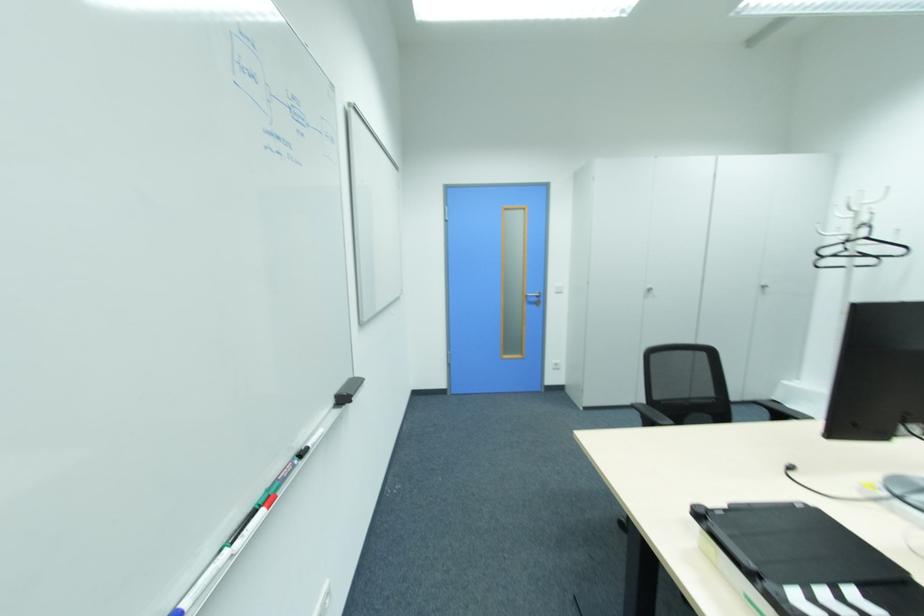
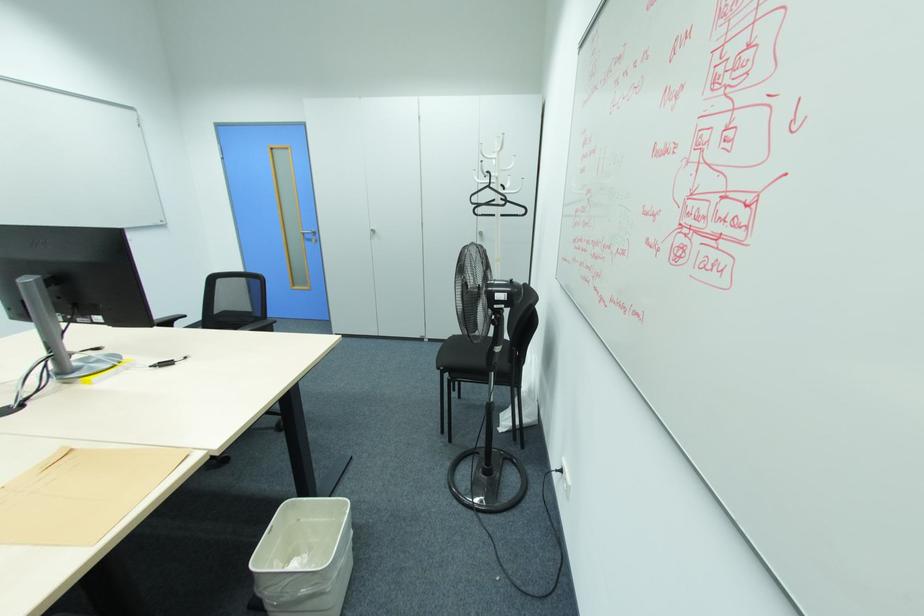
Where in the second image is the point corresponding to pixel 865 238 from the first image?

(490, 187)